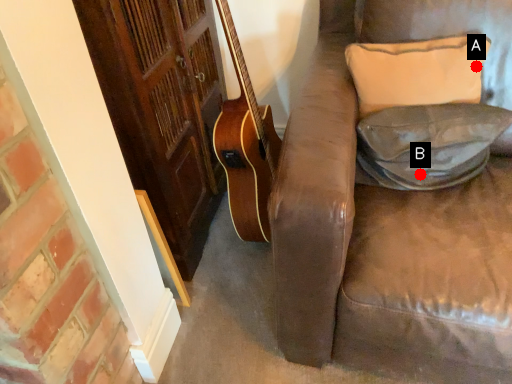
Question: Two points are circled on the image, labeled by A and B beside each circle. Which point is closer to the camera?

Choices:
 (A) A is closer
 (B) B is closer

Answer: (A)